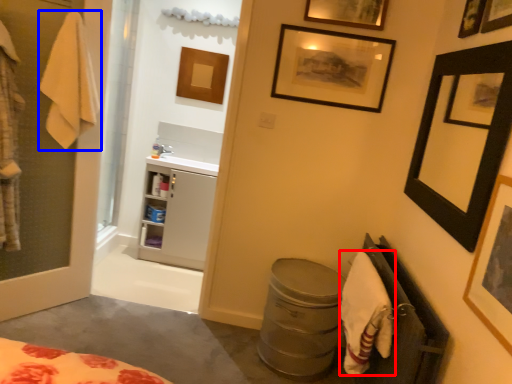
Question: Which of the following is the farthest to the observer, bath towel (highlighted by a red box) or bath towel (highlighted by a blue box)?

Choices:
 (A) bath towel
 (B) bath towel

Answer: (B)